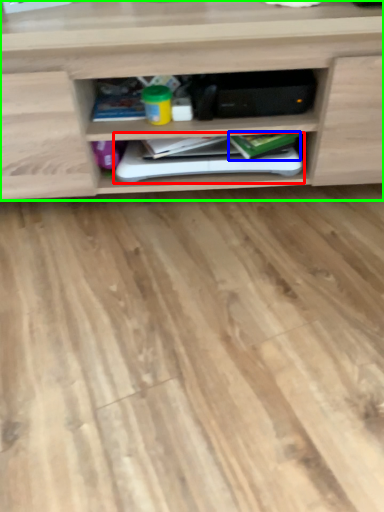
Question: Which object is the closest to the book (highlighted by a red box)? Choose among these: book (highlighted by a blue box) or shelf (highlighted by a green box).

Choices:
 (A) book
 (B) shelf

Answer: (A)